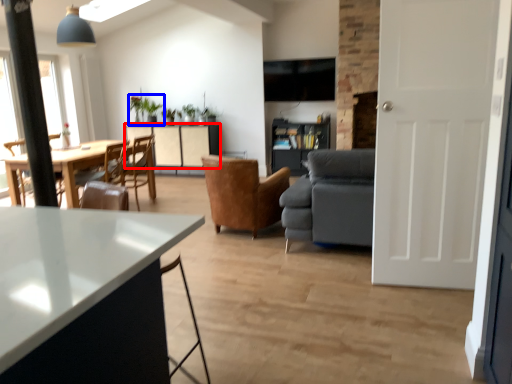
Question: Which of the following is the farthest to the observer, cabinetry (highlighted by a red box) or houseplant (highlighted by a blue box)?

Choices:
 (A) cabinetry
 (B) houseplant

Answer: (B)